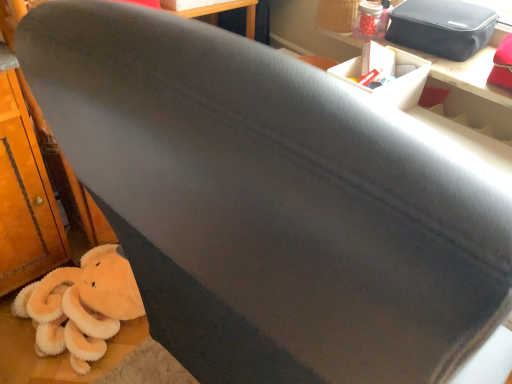
Question: Would you say white cardboard box at upper right is inside or outside matte black table at upper right?

Choices:
 (A) inside
 (B) outside

Answer: (B)

Question: From a real-world perspective, is white cardboard box at upper right physically located above or below matte black table at upper right?

Choices:
 (A) below
 (B) above

Answer: (B)

Question: Which of these objects is positioned farthest from the white cardboard box at upper right?

Choices:
 (A) fluffy orange stuffed animal at lower left
 (B) matte black table at upper right
 (C) black fabric bag at upper right

Answer: (A)

Question: Which is nearer to the white cardboard box at upper right?

Choices:
 (A) black fabric bag at upper right
 (B) fluffy orange stuffed animal at lower left
 (C) matte black table at upper right

Answer: (C)